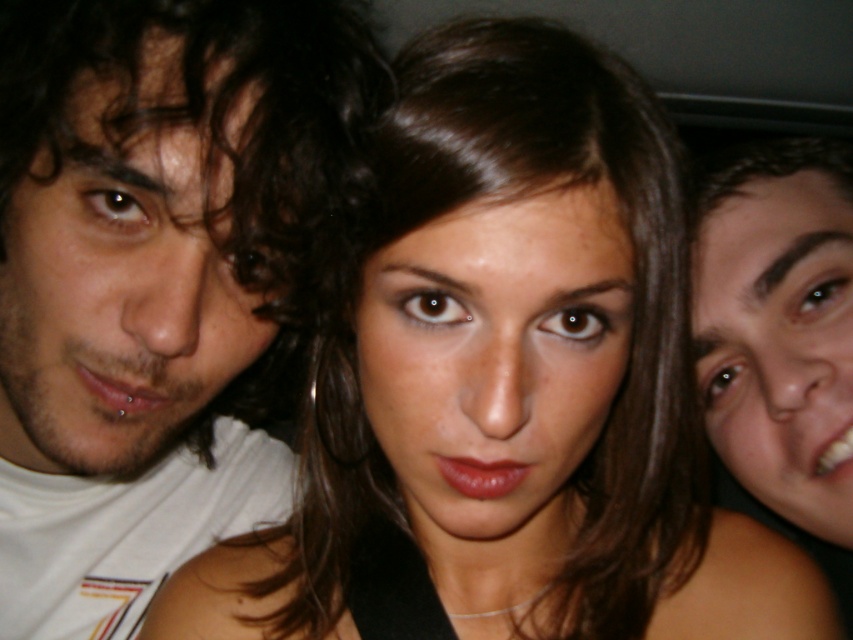
In the scene shown: You are standing at point (83,179) and want to take a photo of the central woman with a camera that has a minimum focusing distance of 50 centimeters. Can you take the photo without moving?

The distance between point (83,179) and the camera is 40.96 centimeters, which is less than the camera minimum focusing distance of 50 centimeters. Therefore, you cannot take the photo without moving closer.